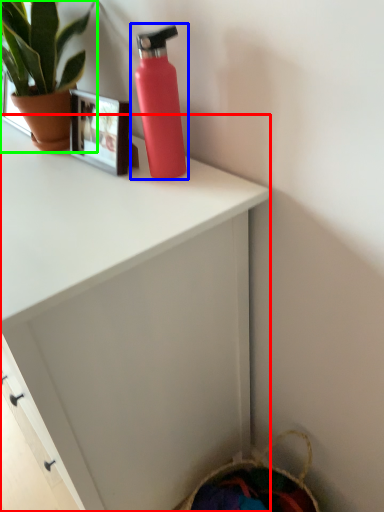
Question: Based on their relative distances, which object is nearer to desk (highlighted by a red box)? Choose from bottle (highlighted by a blue box) and houseplant (highlighted by a green box).

Choices:
 (A) bottle
 (B) houseplant

Answer: (A)